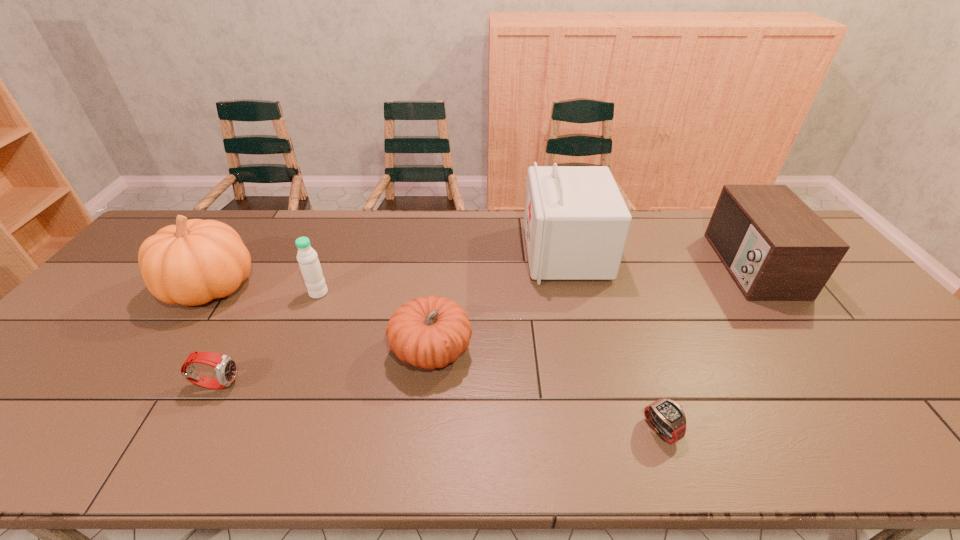
Where is `the first-aid kit`? The height and width of the screenshot is (540, 960). the first-aid kit is located at coordinates (576, 223).

Where is `the second tallest object`? the second tallest object is located at coordinates (191, 263).

I want to click on the left pumpkin, so click(191, 263).

This screenshot has height=540, width=960. Identify the location of the rightmost object. (776, 248).

In order to click on the third object from left to right in this screenshot , I will do `click(309, 264)`.

This screenshot has height=540, width=960. Identify the location of the third shortest object. (431, 332).

This screenshot has height=540, width=960. In order to click on the fourth object from right to left in this screenshot , I will do `click(431, 332)`.

You are a GUI agent. You are given a task and a screenshot of the screen. Output one action in this format:
    pyautogui.click(x=<x>, y=<y>)
    Task: Click on the taller watch
    
    Given the screenshot: What is the action you would take?
    pyautogui.click(x=226, y=367)

Locate an element on the screen. The width and height of the screenshot is (960, 540). the sixth tallest object is located at coordinates (226, 367).

Where is `the right watch`? This screenshot has height=540, width=960. the right watch is located at coordinates (667, 417).